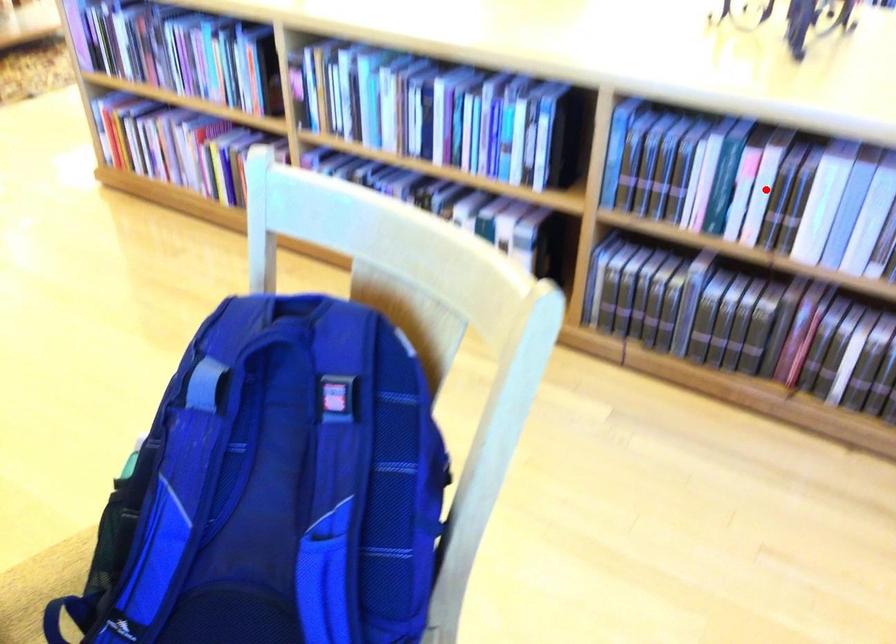
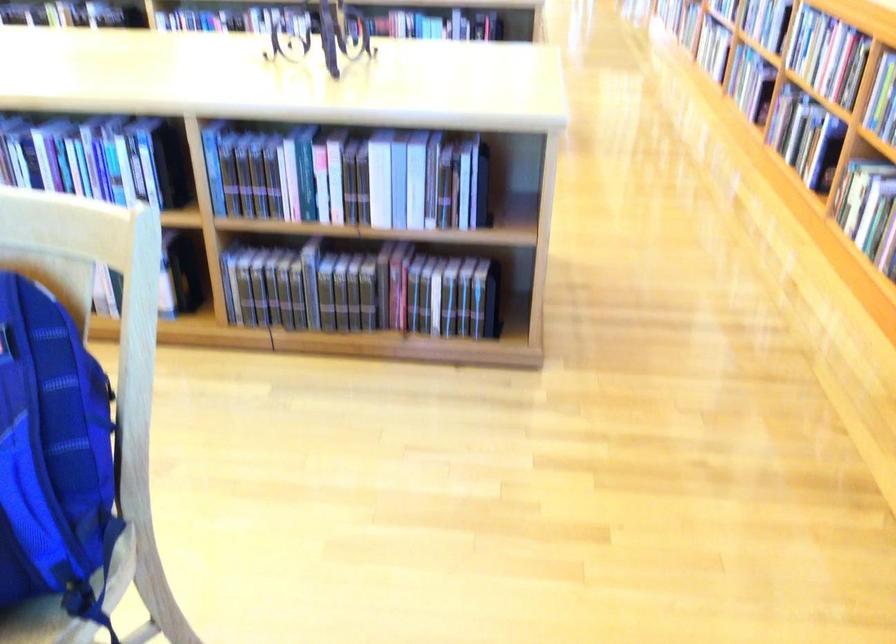
Question: I am providing you with two images of the same scene from different viewpoints. Image1 has a red point marked. In image2, the corresponding 3D location appears at what relative position? Reply with the corresponding letter.

Choices:
 (A) Closer
 (B) Farther

Answer: (B)